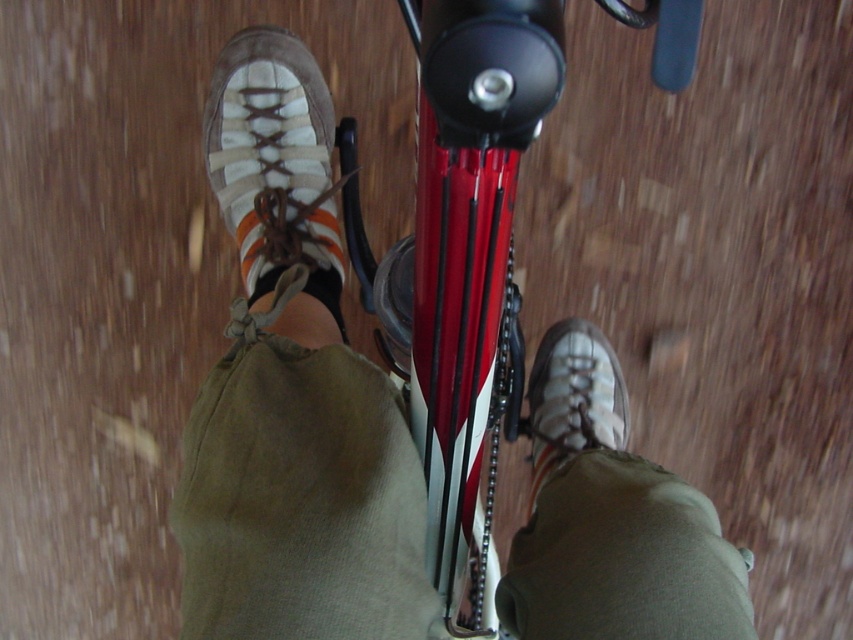
Question: Based on their relative distances, which object is nearer to the brown suede shoe at upper left?

Choices:
 (A) brown suede shoe at lower right
 (B) leather shoe at center

Answer: (B)

Question: Is leather shoe at center smaller than brown suede shoe at lower right?

Choices:
 (A) yes
 (B) no

Answer: (B)

Question: Can you confirm if brown suede shoe at upper left is smaller than brown suede shoe at lower right?

Choices:
 (A) no
 (B) yes

Answer: (A)

Question: Which object is farther from the camera taking this photo?

Choices:
 (A) leather shoe at center
 (B) brown suede shoe at upper left

Answer: (B)

Question: Which object is the farthest from the brown suede shoe at upper left?

Choices:
 (A) brown suede shoe at lower right
 (B) leather shoe at center

Answer: (A)

Question: Can you confirm if leather shoe at center is bigger than brown suede shoe at lower right?

Choices:
 (A) yes
 (B) no

Answer: (A)